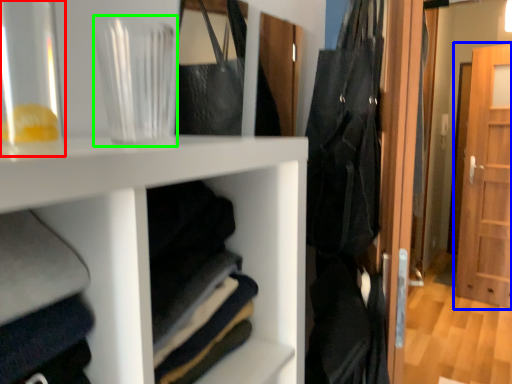
Question: Which object is the farthest from glass vase (highlighted by a red box)? Choose among these: door (highlighted by a blue box) or glass vase (highlighted by a green box).

Choices:
 (A) door
 (B) glass vase

Answer: (A)